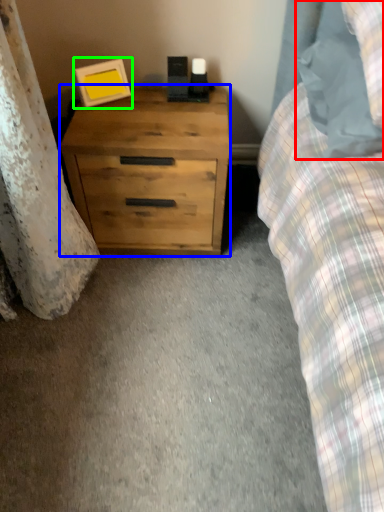
Question: Which object is positioned closest to pillow (highlighted by a red box)? Select from chest of drawers (highlighted by a blue box) and picture frame (highlighted by a green box).

Choices:
 (A) chest of drawers
 (B) picture frame

Answer: (A)